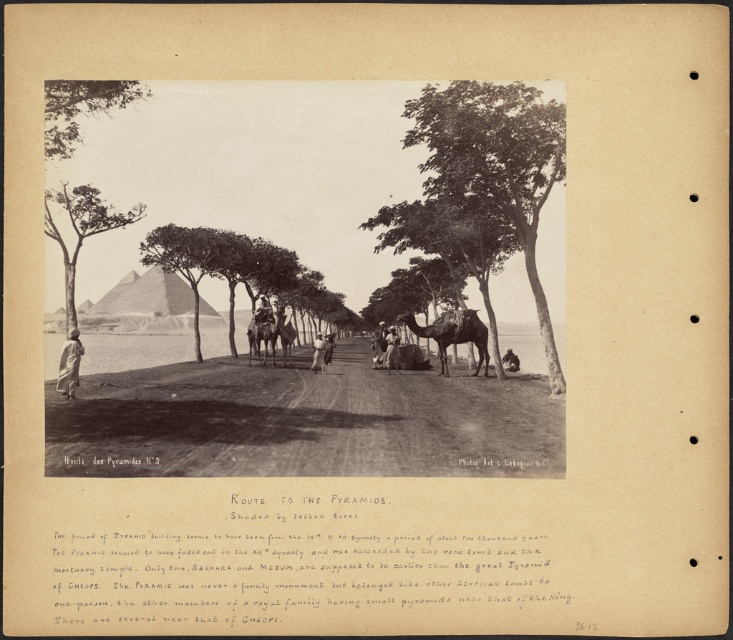
In the scene shown: Can you confirm if smooth bark tree at center is wider than brown leather horse at center?

Correct, the width of smooth bark tree at center exceeds that of brown leather horse at center.

Which is behind, point (191, 250) or point (268, 317)?

Point (191, 250)

Between point (232, 301) and point (265, 348), which one is positioned behind?

The point (232, 301) is behind.

This screenshot has width=733, height=640. What are the coordinates of `smooth bark tree at center` in the screenshot? It's located at (235, 268).

Does point (187, 310) come closer to viewer compared to point (73, 392)?

No, (187, 310) is further to viewer.

From the picture: Is the position of smooth stone pyramid at center less distant than that of light brown fabric at left?

No, it is not.

Who is more forward, (147, 273) or (70, 337)?

Point (70, 337)

This screenshot has width=733, height=640. What are the coordinates of `smooth stone pyramid at center` in the screenshot? It's located at (150, 296).

Who is more distant from viewer, (x=95, y=221) or (x=460, y=321)?

The point (x=460, y=321) is behind.

Who is more forward, (111, 221) or (457, 316)?

Point (111, 221)

Describe the element at coordinates (81, 228) in the screenshot. I see `green leafy tree at left` at that location.

Locate an element on the screen. Image resolution: width=733 pixels, height=640 pixels. green leafy tree at left is located at coordinates (81, 228).